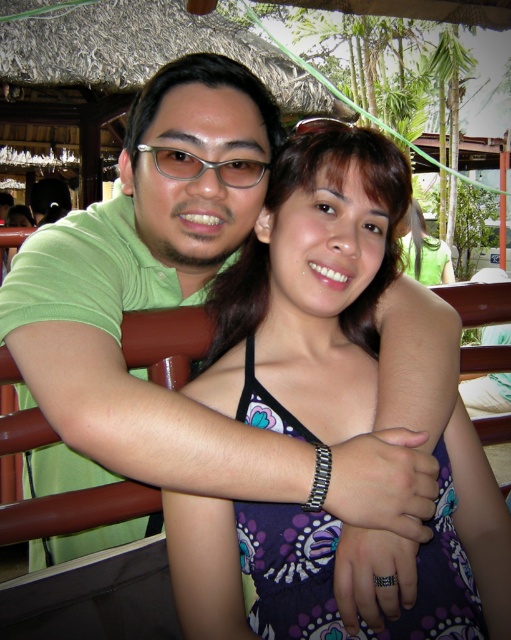
You are standing in the resort area and want to find the purple printed dress at center. The resort uses a coordinate system where the bottom left corner is the origin. The coordinates of the point are given as point [311,289]. Can you determine the direction to walk from this point to reach the purple printed dress at center?

The point [311,289] corresponds to the purple printed dress at center, so you are already at the location of the purple printed dress at center.

You are a photographer trying to capture the purple printed dress at center and the clear plastic glasses at upper center in a photo. Which object should you focus on first if you want to ensure both are in focus, considering their positions?

The purple printed dress at center is positioned on the right side of clear plastic glasses at upper center, so focusing on the clear plastic glasses at upper center first would ensure both are in focus since it is closer to the camera.

You are a photographer adjusting the focus on your camera. You need to ensure that both the purple printed dress at center and the clear plastic glasses at upper center are in focus. Given their positions, which object should you focus on first to ensure both are sharp?

The purple printed dress at center is much taller than the clear plastic glasses at upper center. To ensure both are in focus, you should focus on the purple printed dress at center first, as it is farther away, allowing the depth of field to cover the closer clear plastic glasses at upper center.